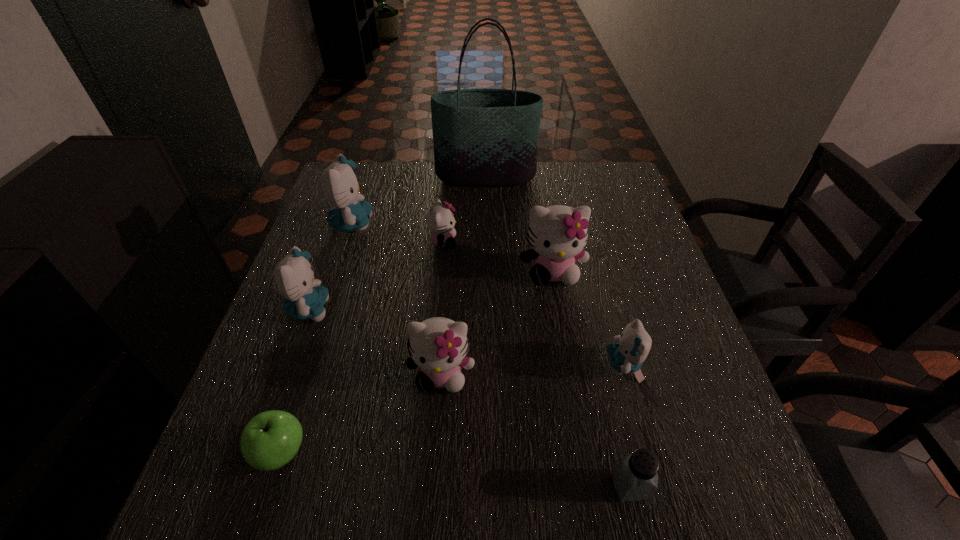
I want to click on unoccupied area between the smallest white kitten and the farthest blue kitten, so click(397, 233).

Locate an element on the screen. This screenshot has width=960, height=540. free area in between the rightmost blue kitten and the green apple is located at coordinates (453, 409).

Where is `vacant area that lies between the farthest white kitten and the nearest blue kitten`? The width and height of the screenshot is (960, 540). vacant area that lies between the farthest white kitten and the nearest blue kitten is located at coordinates (534, 303).

Locate an element on the screen. The image size is (960, 540). object that ranks as the sixth closest to the second biggest blue kitten is located at coordinates (483, 137).

Select which object is the eighth closest to the green tote bag. Please provide its 2D coordinates. Your answer should be formatted as a tuple, i.e. [(x, y)], where the tuple contains the x and y coordinates of a point satisfying the conditions above.

[(635, 477)]

Locate an element on the screen. kitten object that ranks as the third closest to the green apple is located at coordinates (440, 220).

At what (x,y) coordinates should I click in order to perform the action: click on kitten that is the fifth nearest to the second biggest white kitten. Please return your answer as a coordinate pair (x, y). Looking at the image, I should click on (339, 184).

Locate which blue kitten ranks second in proximity to the rightmost blue kitten. Please provide its 2D coordinates. Your answer should be formatted as a tuple, i.e. [(x, y)], where the tuple contains the x and y coordinates of a point satisfying the conditions above.

[(339, 184)]

Locate which blue kitten is the second closest to the smallest blue kitten. Please provide its 2D coordinates. Your answer should be formatted as a tuple, i.e. [(x, y)], where the tuple contains the x and y coordinates of a point satisfying the conditions above.

[(339, 184)]

Identify the location of the second closest white kitten relative to the apple. click(x=440, y=220).